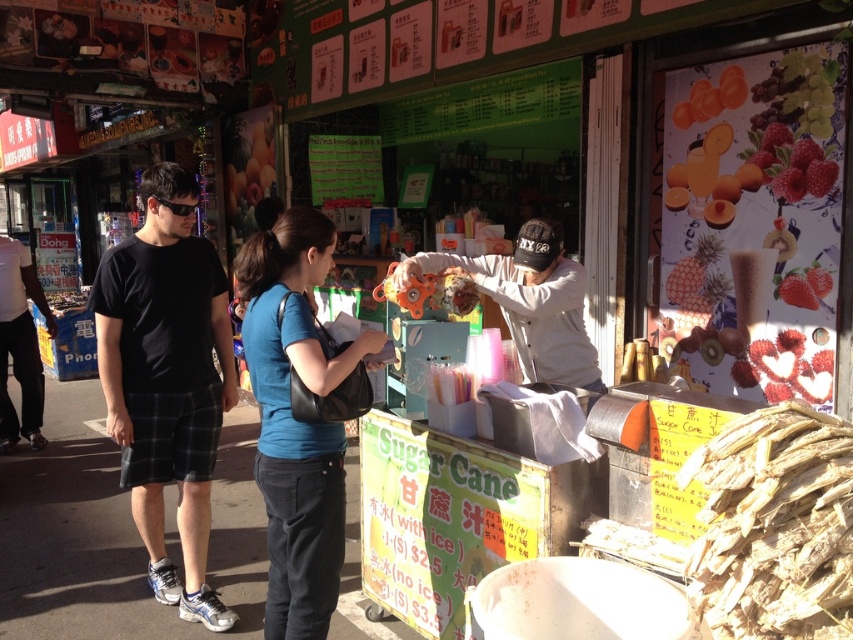
Question: Estimate the real-world distances between objects in this image. Which object is farther from the black plaid shorts at left?

Choices:
 (A) brown rough sugar cane at lower right
 (B) blue fabric shirt at center

Answer: (A)

Question: Is brown rough sugar cane at lower right positioned at the back of white matte street vendor at center?

Choices:
 (A) yes
 (B) no

Answer: (B)

Question: Considering the relative positions of brown rough sugar cane at lower right and white matte street vendor at center in the image provided, where is brown rough sugar cane at lower right located with respect to white matte street vendor at center?

Choices:
 (A) right
 (B) left

Answer: (A)

Question: Can you confirm if brown rough sugar cane at lower right is smaller than white matte street vendor at center?

Choices:
 (A) no
 (B) yes

Answer: (B)

Question: Which object is the closest to the blue fabric shirt at center?

Choices:
 (A) white matte street vendor at center
 (B) brown rough sugar cane at lower right
 (C) black plaid shorts at left

Answer: (A)

Question: Which point is farther to the camera?

Choices:
 (A) (413, 272)
 (B) (167, 394)

Answer: (B)